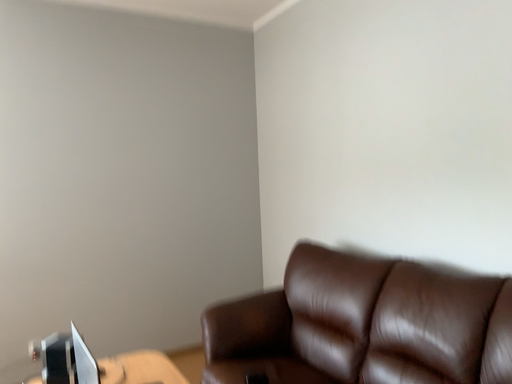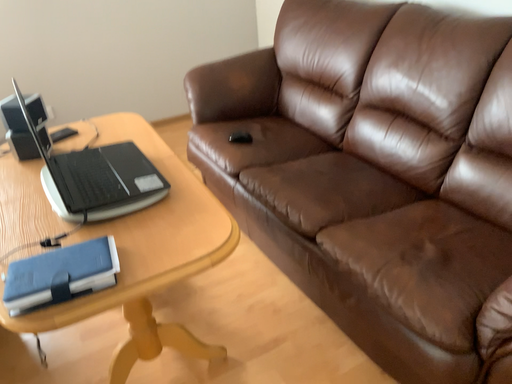
Question: How did the camera likely rotate when shooting the video?

Choices:
 (A) rotated upward
 (B) rotated downward

Answer: (B)